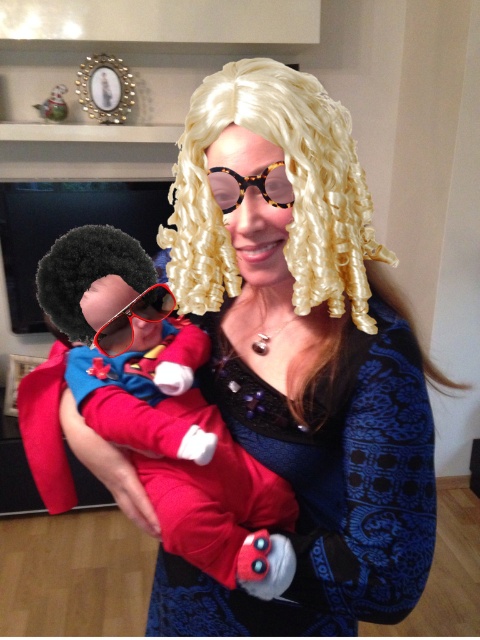
Question: Which object is positioned closest to the red fabric costume at left?

Choices:
 (A) red plastic goggles at center
 (B) tortoiseshell sunglasses at center

Answer: (A)

Question: Does red fabric costume at left come in front of tortoiseshell sunglasses at center?

Choices:
 (A) yes
 (B) no

Answer: (B)

Question: Can you confirm if matte black wig at center is positioned to the left of red fabric costume at left?

Choices:
 (A) yes
 (B) no

Answer: (B)

Question: From the image, what is the correct spatial relationship of red plastic goggles at center in relation to tortoiseshell sunglasses at center?

Choices:
 (A) right
 (B) left

Answer: (B)

Question: Which of the following is the closest to the observer?

Choices:
 (A) (50, 104)
 (B) (225, 179)

Answer: (B)

Question: Which object appears farthest from the camera in this image?

Choices:
 (A) tortoiseshell sunglasses at center
 (B) red plastic goggles at center
 (C) matte plastic toy at upper left
 (D) red fabric costume at left

Answer: (C)